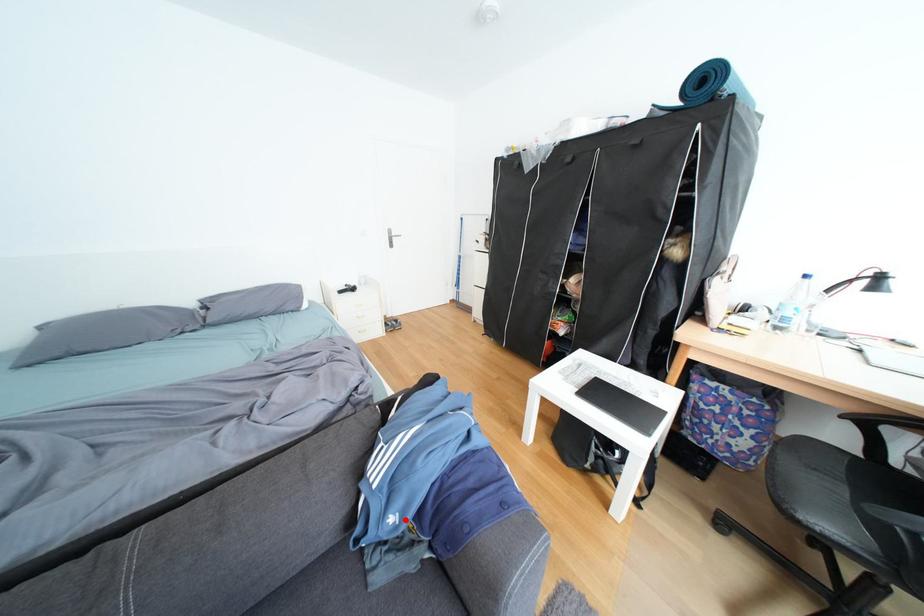
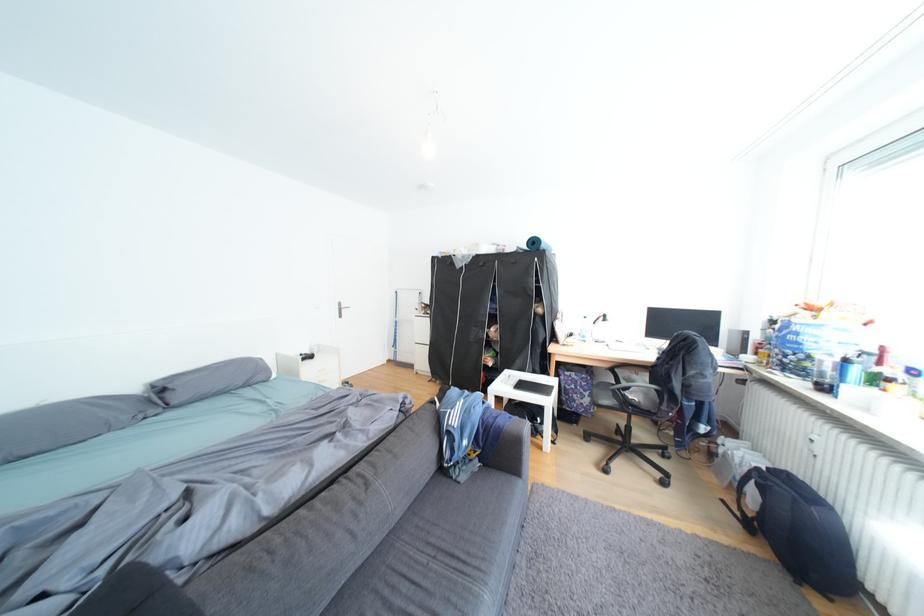
Question: A red point is marked in image1. In image2, is the corresponding 3D point closer to the camera or farther? Reply with the corresponding letter.

Choices:
 (A) The corresponding 3D point is closer.
 (B) The corresponding 3D point is farther.

Answer: (B)